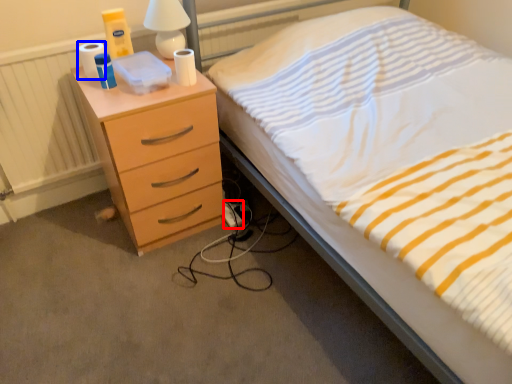
Question: Which of the following is the closest to the observer, extension cord (highlighted by a red box) or toilet paper (highlighted by a blue box)?

Choices:
 (A) extension cord
 (B) toilet paper

Answer: (B)